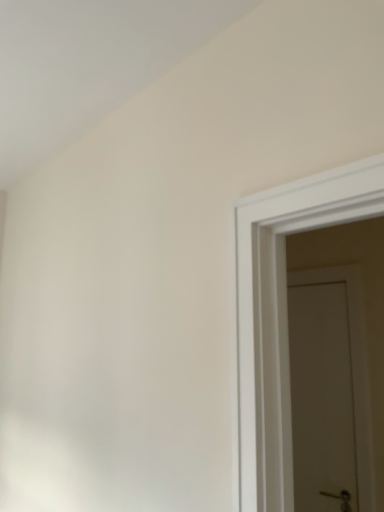
This screenshot has height=512, width=384. Describe the element at coordinates (329, 388) in the screenshot. I see `white matte door at right` at that location.

What is the approximate height of white matte door at right?

white matte door at right is 1.28 meters in height.

Identify the location of white matte door at right. (329, 388).

You are a GUI agent. You are given a task and a screenshot of the screen. Output one action in this format:
    pyautogui.click(x=<x>, y=<y>)
    Task: Click on the white matte door at right
    Image resolution: width=384 pixels, height=512 pixels.
    Given the screenshot: What is the action you would take?
    pyautogui.click(x=329, y=388)